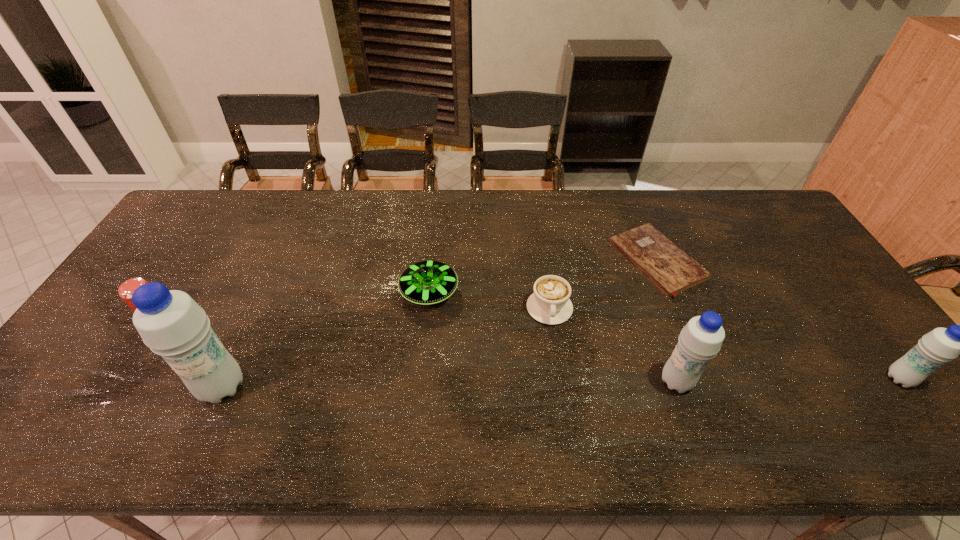
This screenshot has width=960, height=540. I want to click on object that is at the right edge, so click(x=941, y=345).

The height and width of the screenshot is (540, 960). I want to click on object that is at the near right corner, so click(x=941, y=345).

I want to click on free space at the far edge of the desktop, so click(532, 195).

Identify the location of blank space at the near edge of the desktop. (799, 394).

Locate an element on the screen. This screenshot has height=540, width=960. vacant point at the left edge is located at coordinates (126, 307).

Locate an element on the screen. The height and width of the screenshot is (540, 960). vacant space at the far left corner of the desktop is located at coordinates (219, 216).

In the image, there is a desktop. Identify the location of vacant space at the far right corner. Image resolution: width=960 pixels, height=540 pixels. (732, 190).

Find the location of `unoccupied area between the saucer and the leftmost object`. unoccupied area between the saucer and the leftmost object is located at coordinates (293, 304).

Identify the location of empty space that is in between the cappuccino and the second water bottle from right to left. This screenshot has height=540, width=960. (612, 345).

Find the location of a particular element. Image resolution: width=960 pixels, height=540 pixels. blank region between the fourth object from left to right and the second shortest water bottle is located at coordinates (612, 345).